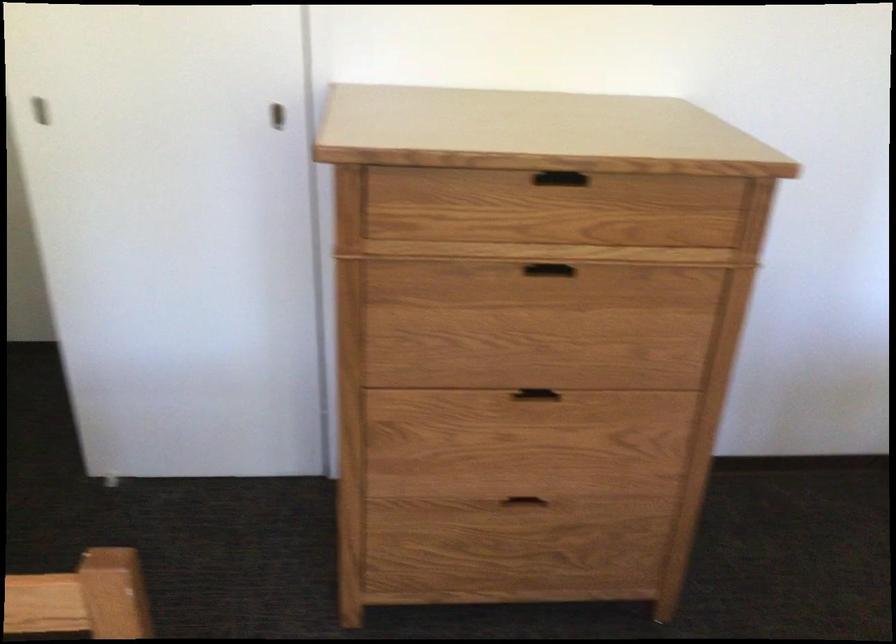
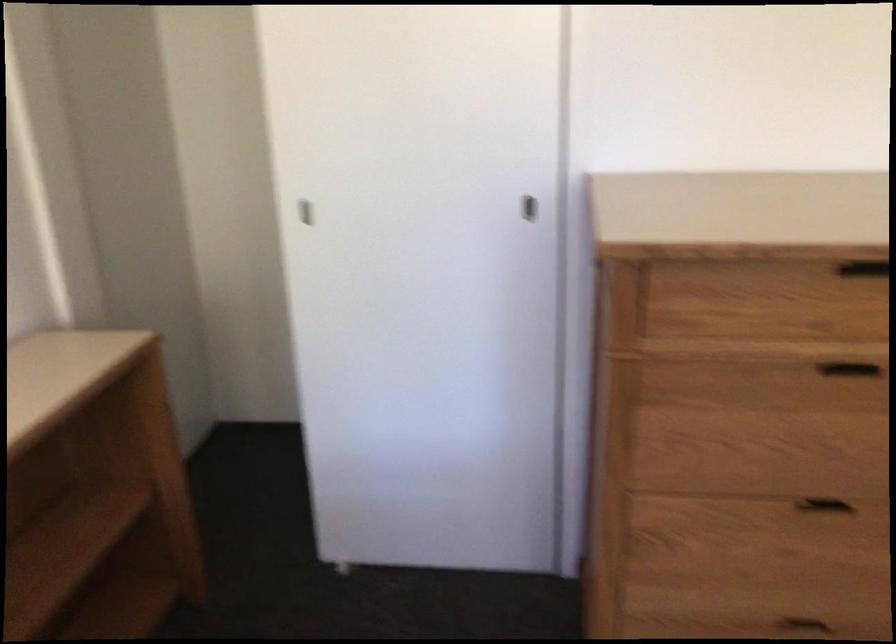
In the second image, find the point that corresponds to (281,120) in the first image.

(530, 209)